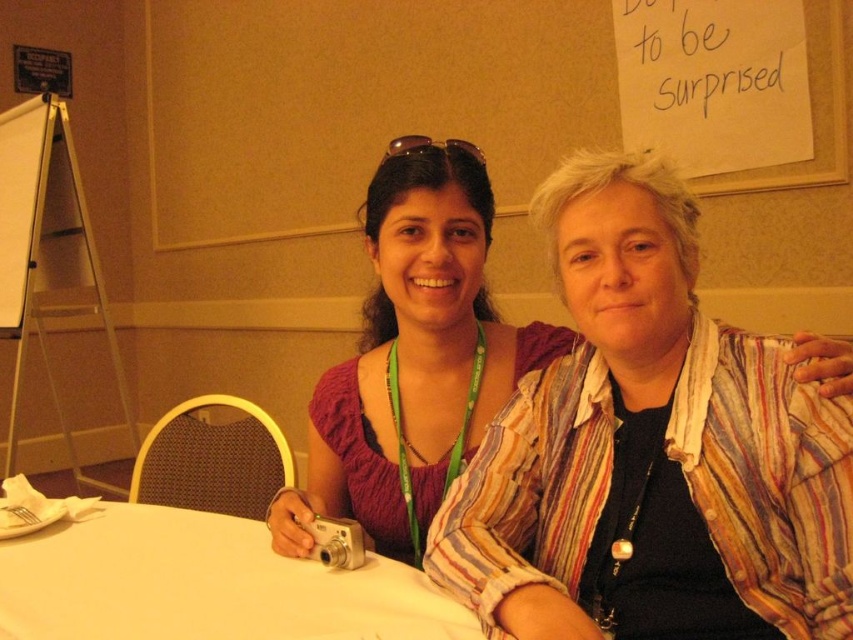
Does white matte table at center have a smaller size compared to whiteboard at left?

Yes, white matte table at center is smaller than whiteboard at left.

What do you see at coordinates (202, 586) in the screenshot? I see `white matte table at center` at bounding box center [202, 586].

The height and width of the screenshot is (640, 853). Describe the element at coordinates (202, 586) in the screenshot. I see `white matte table at center` at that location.

Find the location of `white matte table at center`. white matte table at center is located at coordinates (202, 586).

Can you confirm if matte purple blouse at center is positioned to the right of white matte table at center?

Indeed, matte purple blouse at center is positioned on the right side of white matte table at center.

Which is in front, point (402, 342) or point (239, 554)?

Point (239, 554) is in front.

I want to click on matte purple blouse at center, so click(412, 355).

Measure the distance between matte purple blouse at center and whiteboard at left.

A distance of 2.09 meters exists between matte purple blouse at center and whiteboard at left.

Which is more to the left, matte purple blouse at center or whiteboard at left?

whiteboard at left

The width and height of the screenshot is (853, 640). Describe the element at coordinates (412, 355) in the screenshot. I see `matte purple blouse at center` at that location.

Identify the location of matte purple blouse at center. Image resolution: width=853 pixels, height=640 pixels. (412, 355).